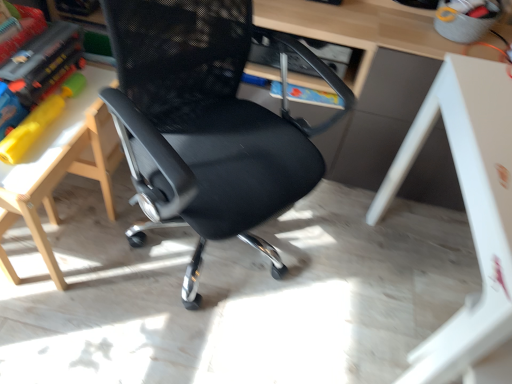
Question: Should I look upward or downward to see matte plastic book at left?

Choices:
 (A) down
 (B) up

Answer: (B)

Question: From a real-world perspective, is white wood table at left, arranged as the 1th table when viewed from the left, on black mesh chair at center?

Choices:
 (A) no
 (B) yes

Answer: (A)

Question: Does white wood table at left, arranged as the 1th table when viewed from the left, touch black mesh chair at center?

Choices:
 (A) no
 (B) yes

Answer: (A)

Question: Does white wood table at left, arranged as the 1th table when viewed from the left, lie behind black mesh chair at center?

Choices:
 (A) yes
 (B) no

Answer: (A)

Question: Is white wood table at left, arranged as the 1th table when viewed from the left, facing towards black mesh chair at center?

Choices:
 (A) yes
 (B) no

Answer: (B)

Question: Does white wood table at left, arranged as the 1th table when viewed from the left, have a larger size compared to black mesh chair at center?

Choices:
 (A) yes
 (B) no

Answer: (B)

Question: Considering the relative sizes of white wood table at left, arranged as the 1th table when viewed from the left, and black mesh chair at center in the image provided, is white wood table at left, arranged as the 1th table when viewed from the left, taller than black mesh chair at center?

Choices:
 (A) no
 (B) yes

Answer: (A)

Question: Is black mesh chair at center to the left of matte plastic book at left from the viewer's perspective?

Choices:
 (A) no
 (B) yes

Answer: (A)

Question: Is black mesh chair at center positioned in front of matte plastic book at left?

Choices:
 (A) no
 (B) yes

Answer: (B)

Question: Does black mesh chair at center have a greater width compared to matte plastic book at left?

Choices:
 (A) no
 (B) yes

Answer: (B)

Question: Can you confirm if black mesh chair at center is thinner than matte plastic book at left?

Choices:
 (A) no
 (B) yes

Answer: (A)

Question: From the image's perspective, would you say black mesh chair at center is positioned over matte plastic book at left?

Choices:
 (A) yes
 (B) no

Answer: (B)

Question: Is the depth of black mesh chair at center greater than that of matte plastic book at left?

Choices:
 (A) yes
 (B) no

Answer: (B)

Question: Is matte plastic book at left not near white glossy table at lower right, arranged as the first table when viewed from the right?

Choices:
 (A) yes
 (B) no

Answer: (A)